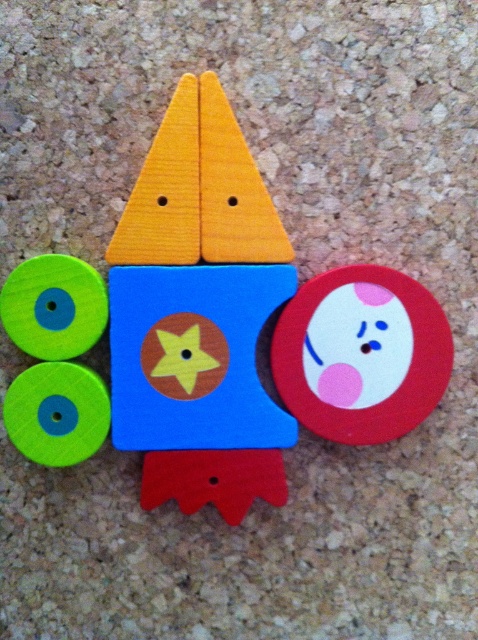
Which of these two, wooden rocket at center or matte red circle at center, stands shorter?

matte red circle at center is shorter.

Is wooden rocket at center shorter than matte red circle at center?

In fact, wooden rocket at center may be taller than matte red circle at center.

Does point (209, 477) come closer to viewer compared to point (346, 355)?

That is True.

You are a GUI agent. You are given a task and a screenshot of the screen. Output one action in this format:
    pyautogui.click(x=<x>, y=<y>)
    Task: Click on the wooden rocket at center
    The image size is (478, 640).
    Given the screenshot: What is the action you would take?
    pyautogui.click(x=225, y=332)